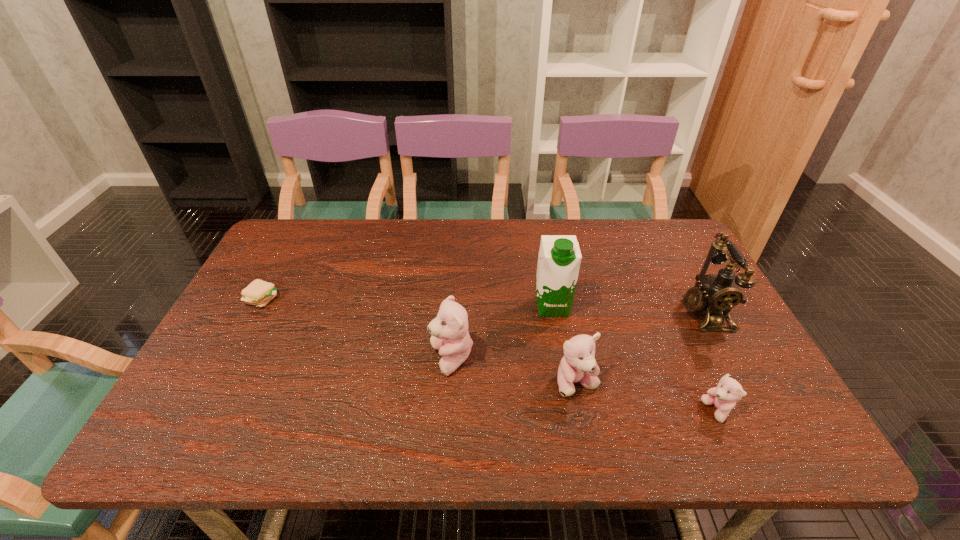
Identify the location of object present at the left edge. (259, 293).

I want to click on teddy bear that is at the right edge, so click(x=728, y=391).

Locate an element on the screen. telephone that is at the right edge is located at coordinates (718, 294).

Where is `object that is at the near right corner`? This screenshot has width=960, height=540. object that is at the near right corner is located at coordinates (728, 391).

Find the location of a particular element. free space at the far edge of the desktop is located at coordinates (396, 236).

I want to click on vacant region at the near edge of the desktop, so click(x=295, y=379).

Where is `free space at the left edge of the desktop`? The height and width of the screenshot is (540, 960). free space at the left edge of the desktop is located at coordinates (249, 306).

I want to click on vacant space at the far left corner of the desktop, so click(x=291, y=228).

This screenshot has width=960, height=540. In order to click on vacant region at the far right corner in this screenshot , I will do `click(658, 227)`.

Identify the location of vacant space that's between the second teddy bear from left to right and the telephone. The width and height of the screenshot is (960, 540). (640, 348).